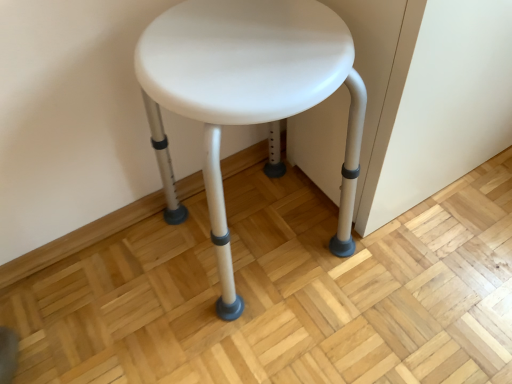
Where is `free space in front of white plastic stool at center`? free space in front of white plastic stool at center is located at coordinates (270, 340).